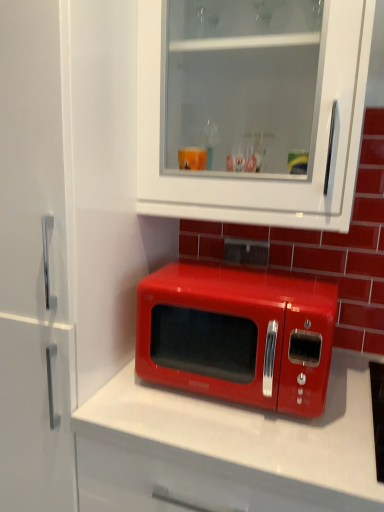
Question: Is glossy red microwave at center taller or shorter than white glossy cabinet at upper center?

Choices:
 (A) short
 (B) tall

Answer: (A)

Question: Looking at their shapes, would you say glossy red microwave at center is wider or thinner than white glossy cabinet at upper center?

Choices:
 (A) thin
 (B) wide

Answer: (B)

Question: From a real-world perspective, relative to white glossy cabinet at upper center, is glossy red microwave at center vertically above or below?

Choices:
 (A) below
 (B) above

Answer: (A)

Question: In the image, is white glossy cabinet at upper center positioned in front of or behind glossy red microwave at center?

Choices:
 (A) behind
 (B) front

Answer: (B)

Question: From a real-world perspective, is white glossy cabinet at upper center above or below glossy red microwave at center?

Choices:
 (A) above
 (B) below

Answer: (A)

Question: Looking at their shapes, would you say white glossy cabinet at upper center is wider or thinner than glossy red microwave at center?

Choices:
 (A) wide
 (B) thin

Answer: (B)

Question: In terms of height, does white glossy cabinet at upper center look taller or shorter compared to glossy red microwave at center?

Choices:
 (A) short
 (B) tall

Answer: (B)